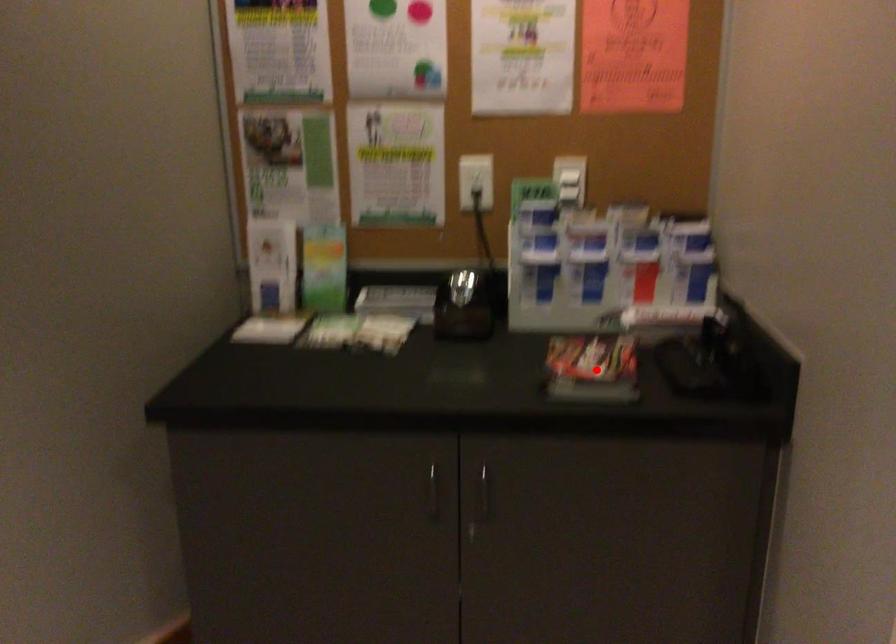
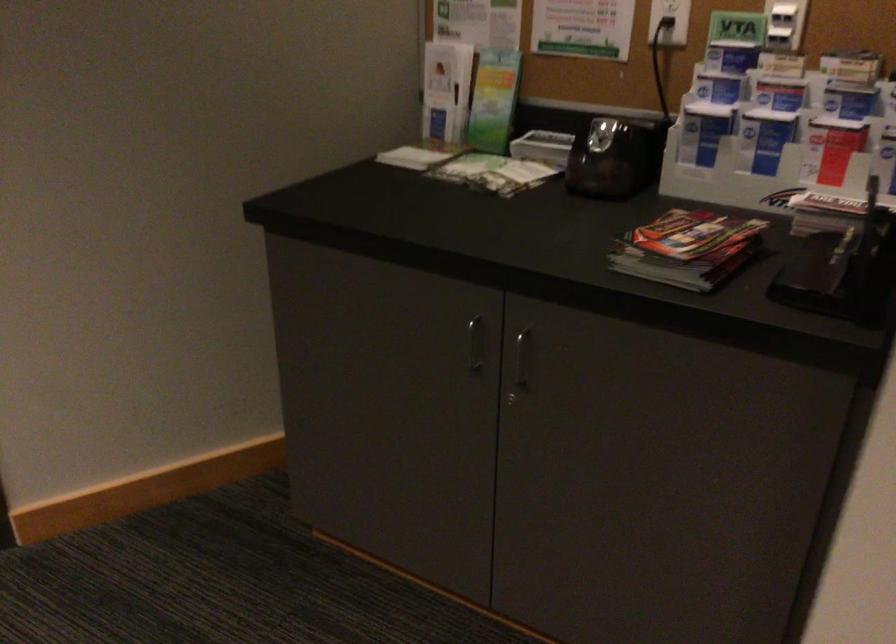
Find the pixel in the second image that matches the highlighted location in the first image.

(687, 249)